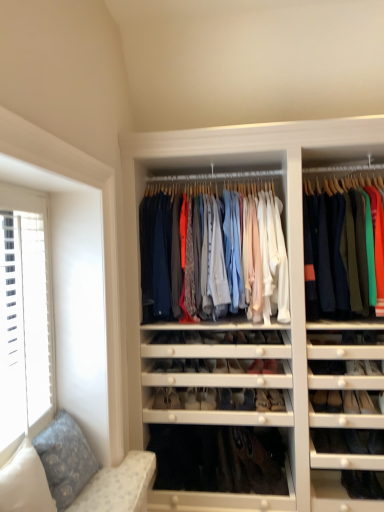
Question: Considering the positions of point (14, 416) and point (203, 398), is point (14, 416) closer or farther from the camera than point (203, 398)?

Choices:
 (A) closer
 (B) farther

Answer: (A)

Question: From the image's perspective, is white textured window at left above or below matte white shoe at center, arranged as the fourth shoe when viewed from the left?

Choices:
 (A) below
 (B) above

Answer: (B)

Question: Estimate the real-world distances between objects in this image. Which object is closer to the matte white shoe at center, arranged as the fourth shoe when viewed from the left?

Choices:
 (A) solid navy blue pants at right, which is the 1th clothing from right to left
 (B) matte cotton shirts at center, which is counted as the 2th clothing, starting from the right
 (C) matte black shoe at center, arranged as the 5th shoe when viewed from the left
 (D) matte black shoe at center, arranged as the seventh shoe when viewed from the left
 (E) matte black shoe at center, which is counted as the 7th shoe, starting from the right

Answer: (C)

Question: Which object is the farthest from the solid navy blue pants at right, which is the 1th clothing from right to left?

Choices:
 (A) matte white shoe at center, which is the fourth shoe in right-to-left order
 (B) white textured window at left
 (C) matte white shoe at center, which is counted as the 3th shoe, starting from the left
 (D) matte cotton shirts at center, which is counted as the 2th clothing, starting from the right
 (E) matte black shoe at center, the 1th shoe viewed from the right

Answer: (B)